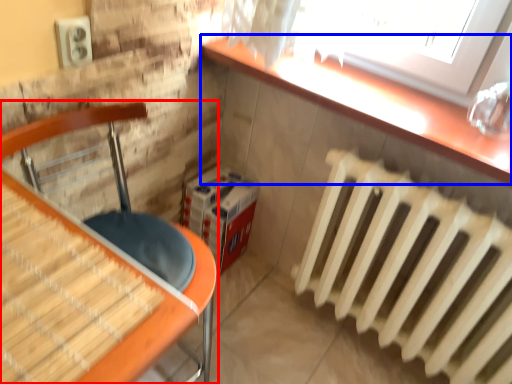
Question: Which point is closer to the camera, furniture (highlighted by a red box) or counter top (highlighted by a blue box)?

Choices:
 (A) furniture
 (B) counter top

Answer: (A)